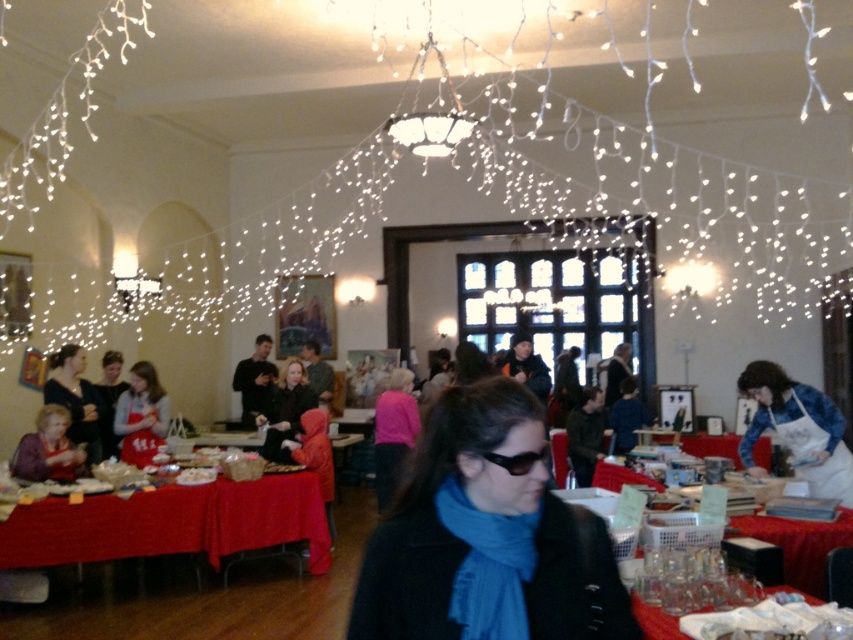
Question: Considering the relative positions of black matte coat at center and white apron at right in the image provided, where is black matte coat at center located with respect to white apron at right?

Choices:
 (A) above
 (B) below

Answer: (A)

Question: Does white apron at right appear on the right side of black plastic goggles at center?

Choices:
 (A) no
 (B) yes

Answer: (B)

Question: Which object is the closest to the black plastic goggles at center?

Choices:
 (A) red fabric table at lower left
 (B) red apron at center
 (C) matte black sweater at lower left
 (D) pink fabric at center

Answer: (A)

Question: Is red fabric table at lower left to the left of matte black jacket at center from the viewer's perspective?

Choices:
 (A) no
 (B) yes

Answer: (B)

Question: Which point is closer to the camera?

Choices:
 (A) (750, 433)
 (B) (502, 454)

Answer: (B)

Question: Among these points, which one is farthest from the camera?

Choices:
 (A) (502, 456)
 (B) (840, 472)

Answer: (B)